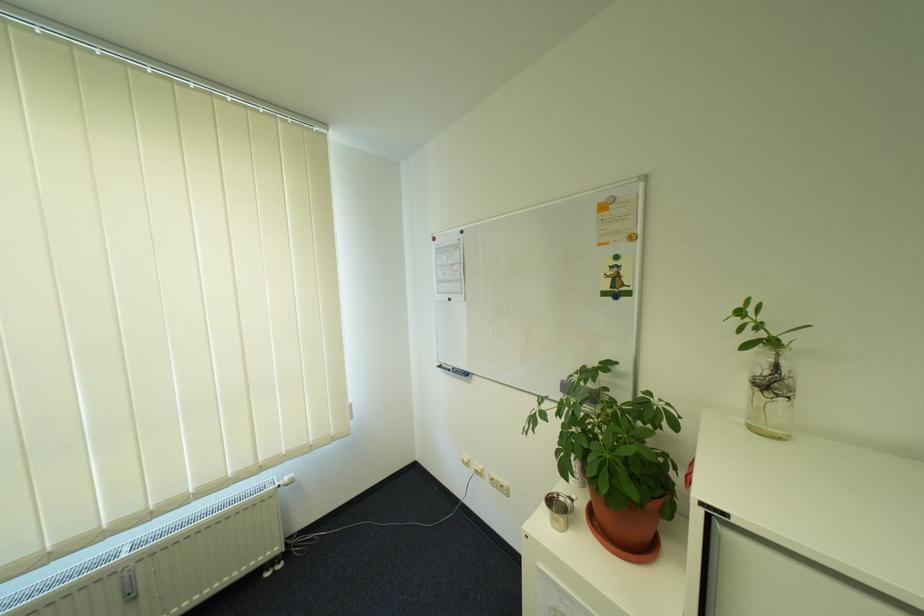
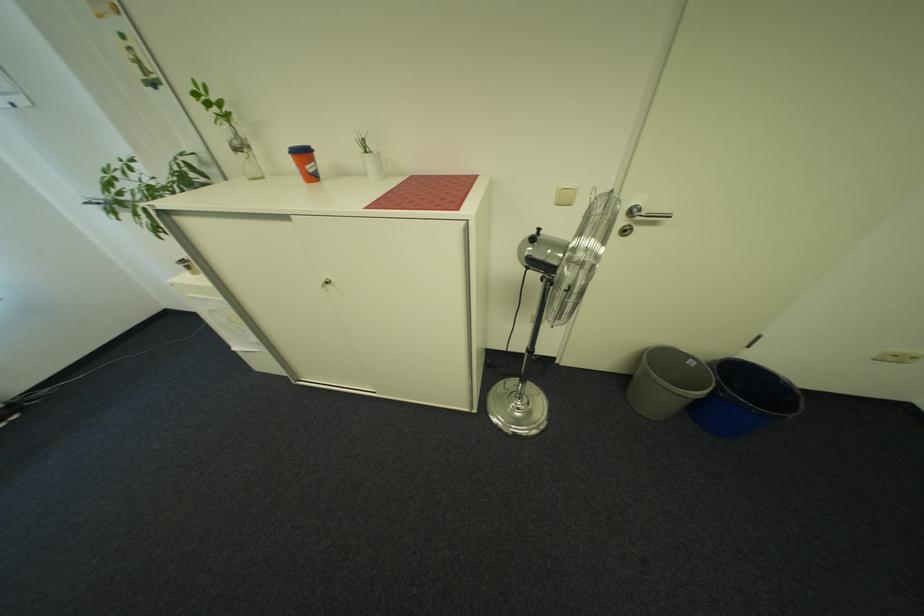
In the second image, find the point that corresponds to (798,399) in the first image.

(252, 153)